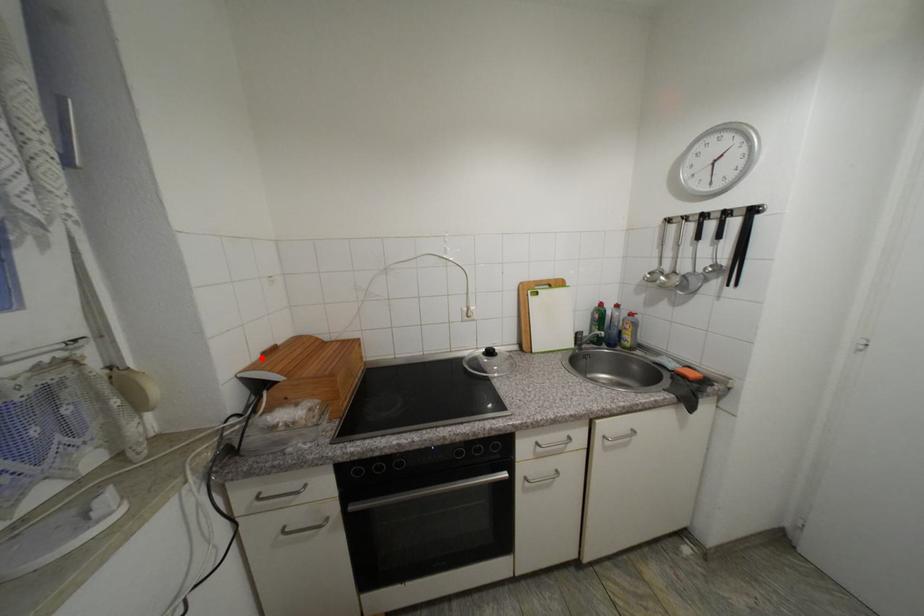
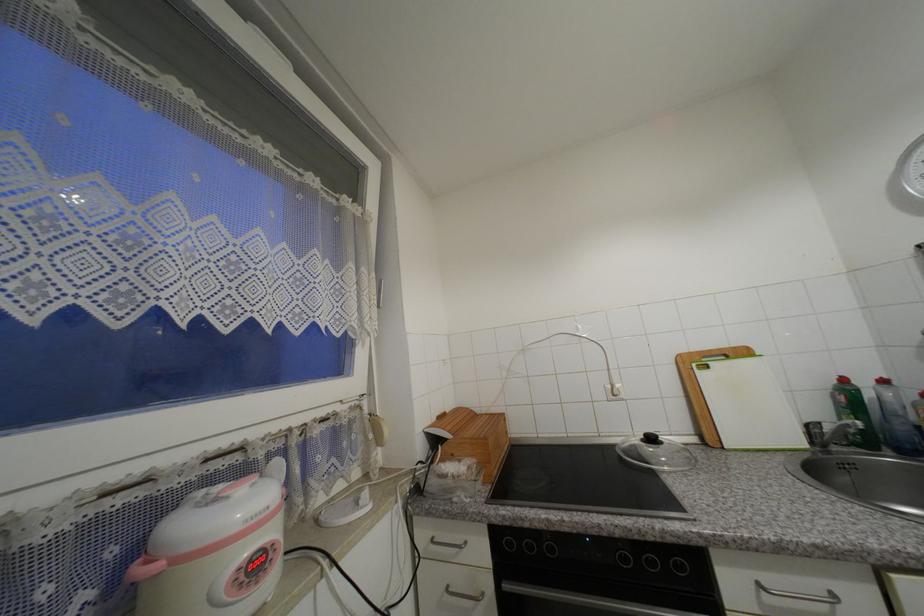
Find the pixel in the second image that matches the highlighted location in the first image.

(440, 419)